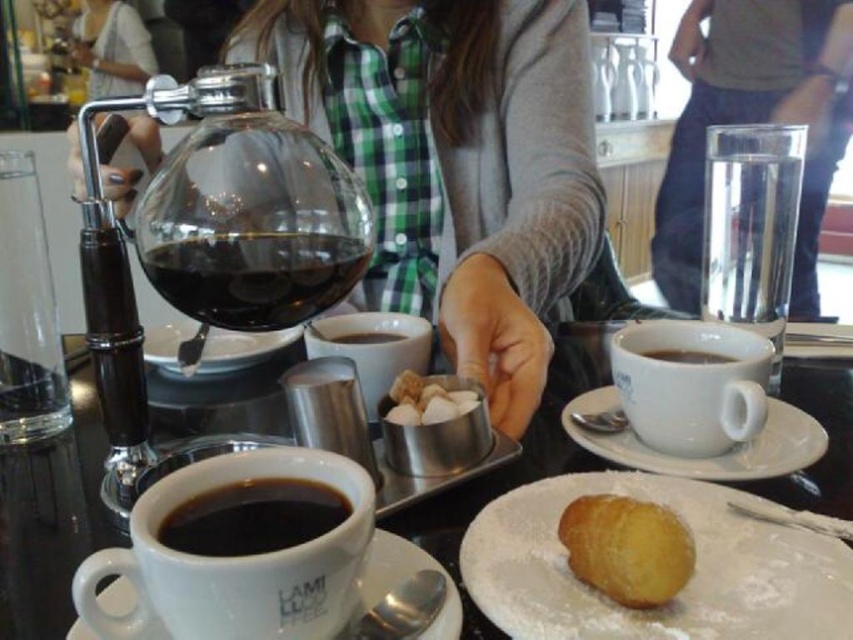
You are a barista at the coffee shop and need to place both the white ceramic sugar bowl at center and the white sugar cubes at center on a shelf. The shelf has a height limit of 10 cm. Can both items fit vertically on the shelf without exceeding the height limit?

The white ceramic sugar bowl at center has a larger size compared to white sugar cubes at center. Since the sugar bowl is larger, it might exceed the 10 cm height limit. To determine if both can fit, check the individual heights. If the sugar bowl is under 10 cm and the sugar cubes stack doesn

Based on the scene description, where is the white ceramic sugar bowl at center located in the image?

The white ceramic sugar bowl at center is located at point coordinates of [51,522].

You are a barista trying to place the white ceramic saucer at lower center on the table without touching the powdered sugar donut at lower right. Can you fit it there?

The distance between the powdered sugar donut at lower right and the white ceramic saucer at lower center is 3.37 inches, so yes, the saucer can be placed there without touching the donut as there is enough space between them.